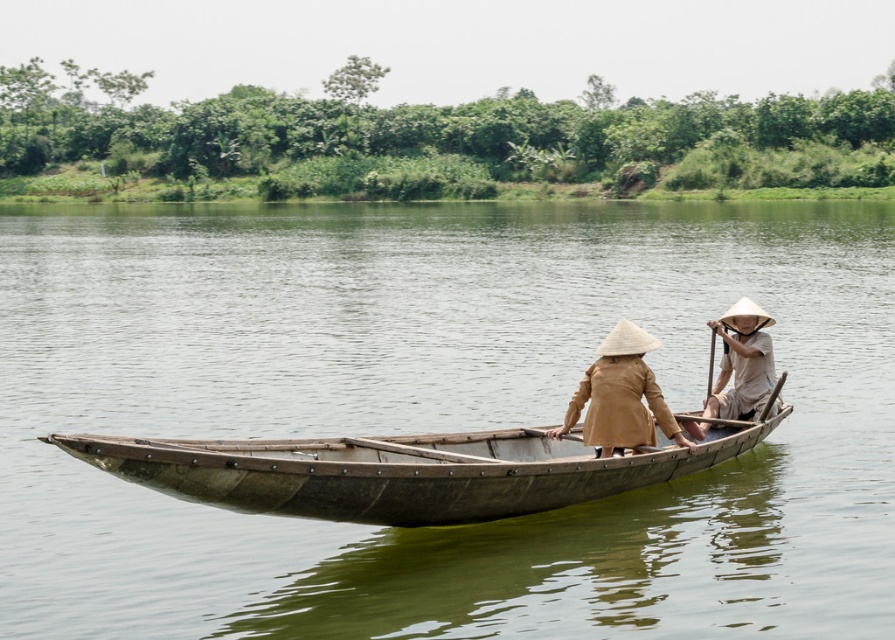
You are a tourist on a boat and want to take a photo of the brown matte conical hat at center and the light brown wooden paddle at right. Which object should you focus on first if you want to capture both in the same frame without moving your camera?

The brown matte conical hat at center is positioned under the light brown wooden paddle at right, so you should focus on the light brown wooden paddle at right first to ensure both are in the frame.

You are standing on the bank of the river and see two points marked on the boat. Which point is closer to you, point (x=553, y=301) or point (x=578, y=410)?

Point (x=553, y=301) is closer to you because it is further to the viewer than point (x=578, y=410).